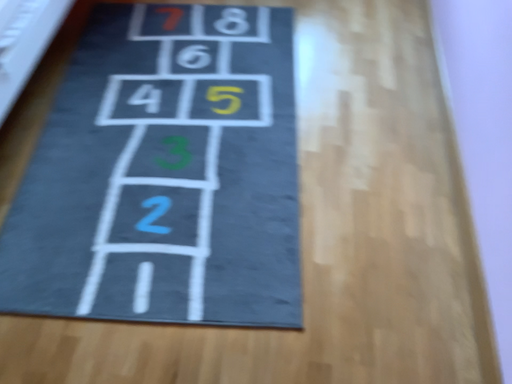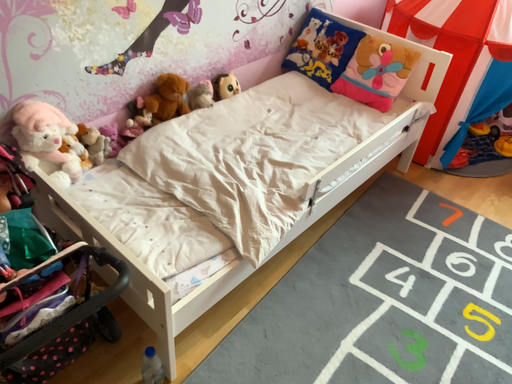
Question: Which way did the camera rotate in the video?

Choices:
 (A) rotated left
 (B) rotated right

Answer: (A)